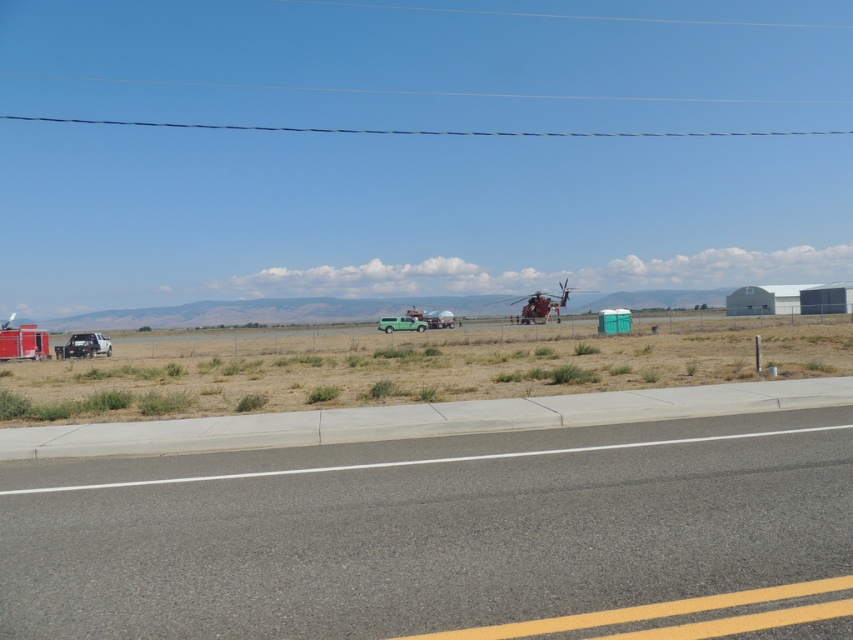
Is asphalt road at center below metallic silver trailer truck at left?

Correct, asphalt road at center is located below metallic silver trailer truck at left.

In the scene shown: Who is more distant from viewer, (637, 508) or (42, 332)?

The point (42, 332) is more distant.

Which is in front, point (566, 449) or point (3, 349)?

Point (566, 449)

Where is `asphalt road at center`? The width and height of the screenshot is (853, 640). asphalt road at center is located at coordinates pos(427,531).

Between asphalt road at center and green matte van at center, which one has less height?

With less height is asphalt road at center.

Based on the photo, between asphalt road at center and green matte van at center, which one has more height?

green matte van at center is taller.

Between point (851, 440) and point (416, 324), which one is positioned behind?

Point (416, 324)

Where is `asphalt road at center`? The image size is (853, 640). asphalt road at center is located at coordinates (427, 531).

Who is taller, matte black truck at left or green matte van at center?

With more height is green matte van at center.

Locate an element on the screen. matte black truck at left is located at coordinates (84, 346).